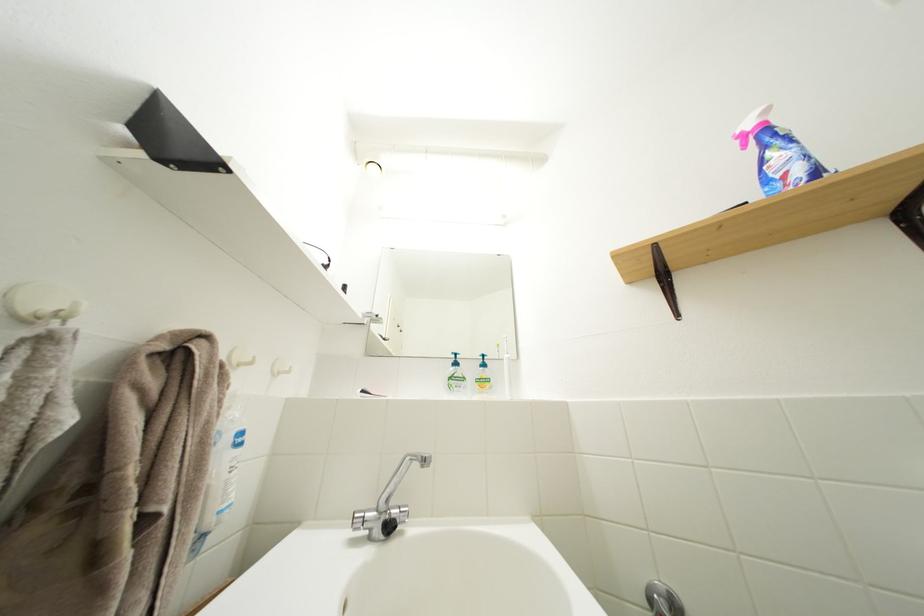
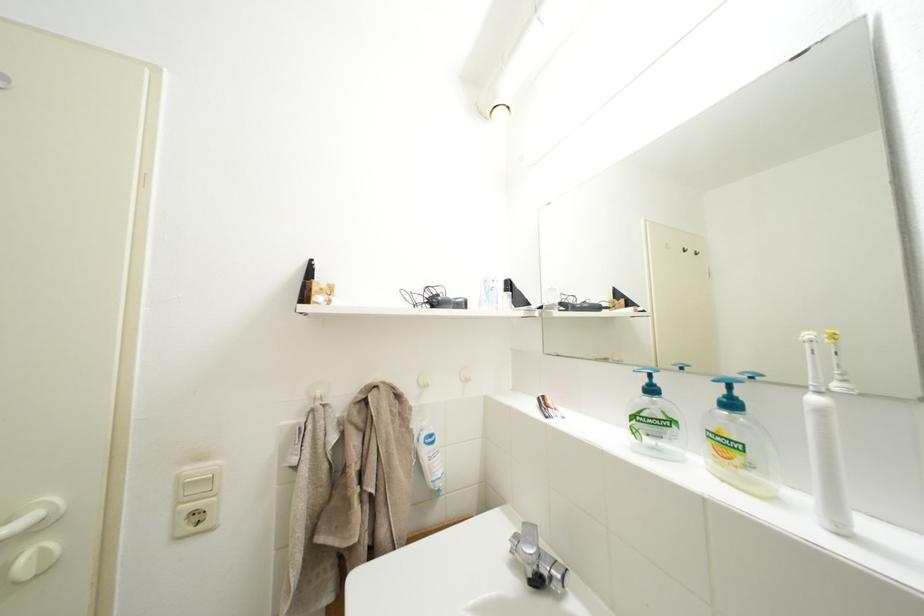
Question: The images are taken continuously from a first-person perspective. In which direction is your viewpoint rotating?

Choices:
 (A) Left
 (B) Right
 (C) Up
 (D) Down

Answer: (A)